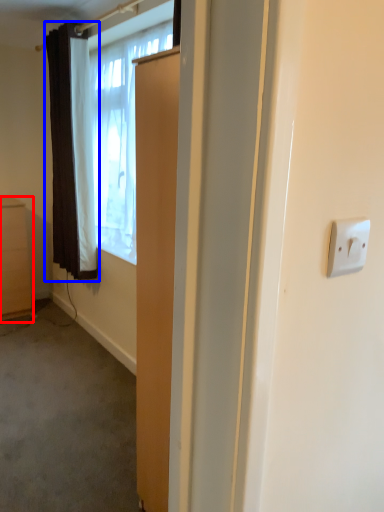
Question: Which of the following is the closest to the observer, cabinetry (highlighted by a red box) or curtain (highlighted by a blue box)?

Choices:
 (A) cabinetry
 (B) curtain

Answer: (B)